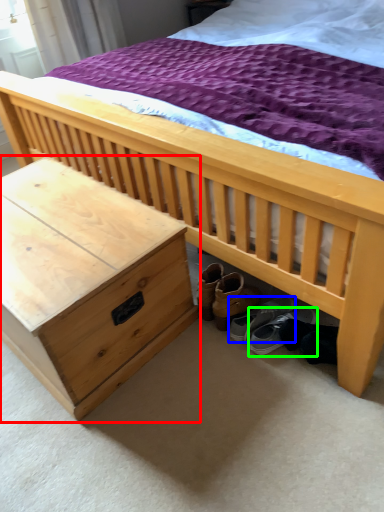
Question: Estimate the real-world distances between objects in this image. Which object is farther from nightstand (highlighted by a red box), footwear (highlighted by a blue box) or footwear (highlighted by a green box)?

Choices:
 (A) footwear
 (B) footwear

Answer: (B)